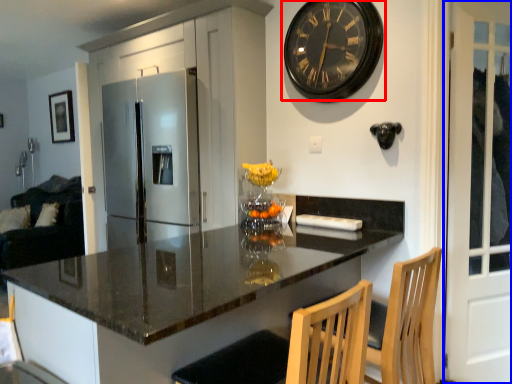
Question: Among these objects, which one is farthest to the camera, wall clock (highlighted by a red box) or screen door (highlighted by a blue box)?

Choices:
 (A) wall clock
 (B) screen door

Answer: (A)